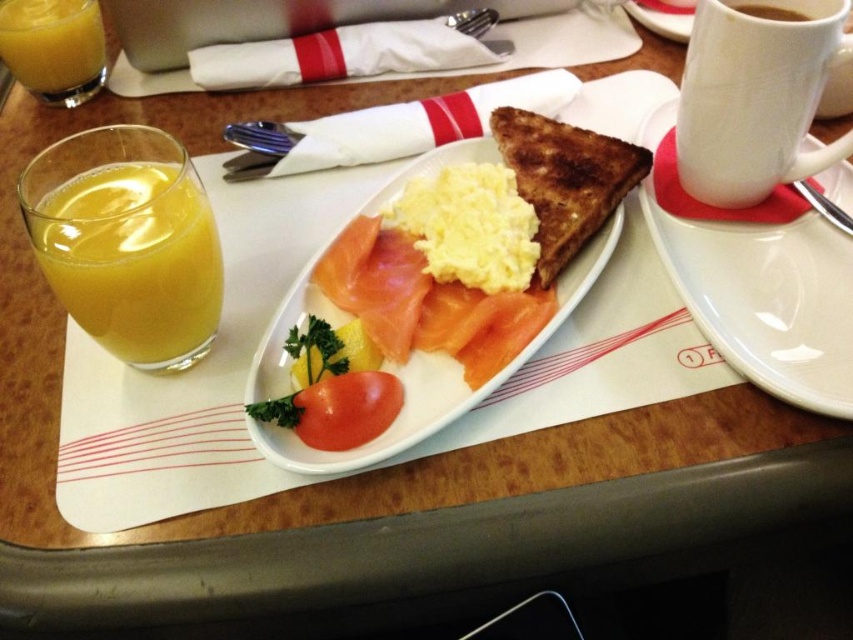
Question: Is translucent yellow liquid at left smaller than translucent glass of orange juice at left?

Choices:
 (A) yes
 (B) no

Answer: (B)

Question: Which of the following is the farthest from the observer?

Choices:
 (A) smooth white plate at center
 (B) translucent glass of orange juice at left
 (C) white ceramic mug at upper right

Answer: (B)

Question: Which object is positioned farthest from the brown crispy toast at center?

Choices:
 (A) smooth white plate at center
 (B) translucent glass of orange juice at left
 (C) white ceramic plate at center
 (D) white ceramic mug at upper right

Answer: (B)

Question: Can you confirm if white ceramic mug at upper right is positioned above translucent glass of orange juice at left?

Choices:
 (A) yes
 (B) no

Answer: (B)

Question: Is white ceramic plate at center to the left of brown crispy toast at center from the viewer's perspective?

Choices:
 (A) yes
 (B) no

Answer: (B)

Question: Among these objects, which one is farthest from the camera?

Choices:
 (A) translucent glass of orange juice at left
 (B) red matte tomato at center
 (C) white ceramic plate at center
 (D) brown matte cup at upper right

Answer: (A)